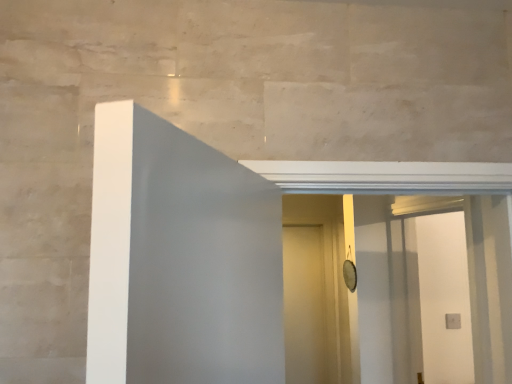
Question: Is white matte door at center to the left or to the right of white glossy screen door at center in the image?

Choices:
 (A) left
 (B) right

Answer: (A)

Question: Is point (306, 329) positioned closer to the camera than point (428, 306)?

Choices:
 (A) closer
 (B) farther

Answer: (B)

Question: Looking at the image, does white matte door at center seem bigger or smaller compared to white glossy screen door at center?

Choices:
 (A) small
 (B) big

Answer: (A)

Question: Looking at the image, does white glossy screen door at center seem bigger or smaller compared to white matte door at center?

Choices:
 (A) small
 (B) big

Answer: (B)

Question: In the image, is white glossy screen door at center positioned in front of or behind white matte door at center?

Choices:
 (A) front
 (B) behind

Answer: (A)

Question: From the image's perspective, is white glossy screen door at center located above or below white matte door at center?

Choices:
 (A) below
 (B) above

Answer: (B)

Question: Choose the correct answer: Is white glossy screen door at center inside white matte door at center or outside it?

Choices:
 (A) inside
 (B) outside

Answer: (B)